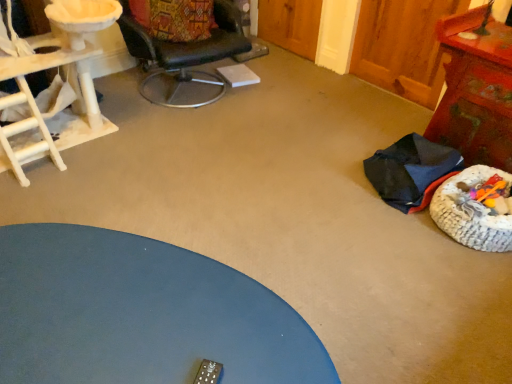
Question: Does blue matte table at lower left, which is the second table from right to left, appear on the left side of wooden textured table at right, acting as the 2th table starting from the front?

Choices:
 (A) no
 (B) yes

Answer: (B)

Question: Is blue matte table at lower left, marked as the first table in a left-to-right arrangement, oriented towards wooden textured table at right, which is the second table from left to right?

Choices:
 (A) no
 (B) yes

Answer: (B)

Question: Is blue matte table at lower left, marked as the first table in a left-to-right arrangement, bigger than wooden textured table at right, which is the second table from left to right?

Choices:
 (A) no
 (B) yes

Answer: (B)

Question: Does blue matte table at lower left, arranged as the 1th table when ordered from the bottom, lie in front of wooden textured table at right, which is counted as the 2th table, starting from the bottom?

Choices:
 (A) yes
 (B) no

Answer: (A)

Question: Is blue matte table at lower left, marked as the first table in a left-to-right arrangement, not near wooden textured table at right, which appears as the first table when viewed from the top?

Choices:
 (A) no
 (B) yes

Answer: (B)

Question: From a real-world perspective, is blue matte table at lower left, the 2th table viewed from the back, beneath wooden textured table at right, which is the second table from left to right?

Choices:
 (A) yes
 (B) no

Answer: (A)

Question: From a real-world perspective, does dark blue fabric chair at lower right, the first chair when ordered from bottom to top, stand above black leather chair at upper center, which ranks as the 1th chair in top-to-bottom order?

Choices:
 (A) no
 (B) yes

Answer: (A)

Question: Is the depth of dark blue fabric chair at lower right, marked as the first chair in a right-to-left arrangement, less than that of black leather chair at upper center, the second chair when ordered from bottom to top?

Choices:
 (A) no
 (B) yes

Answer: (B)

Question: Considering the relative sizes of dark blue fabric chair at lower right, marked as the first chair in a right-to-left arrangement, and black leather chair at upper center, the 1th chair from the left, in the image provided, is dark blue fabric chair at lower right, marked as the first chair in a right-to-left arrangement, smaller than black leather chair at upper center, the 1th chair from the left,?

Choices:
 (A) yes
 (B) no

Answer: (A)

Question: Can you confirm if dark blue fabric chair at lower right, which is the second chair in left-to-right order, is thinner than black leather chair at upper center, placed as the 2th chair when sorted from right to left?

Choices:
 (A) no
 (B) yes

Answer: (B)

Question: Is dark blue fabric chair at lower right, the first chair when ordered from bottom to top, not within black leather chair at upper center, which ranks as the 1th chair in top-to-bottom order?

Choices:
 (A) no
 (B) yes

Answer: (B)

Question: Is dark blue fabric chair at lower right, the first chair when ordered from bottom to top, shorter than black leather chair at upper center, the second chair when ordered from bottom to top?

Choices:
 (A) no
 (B) yes

Answer: (B)

Question: From a real-world perspective, is dark blue fabric chair at lower right, the first chair when ordered from bottom to top, below blue matte table at lower left, the 2th table viewed from the back?

Choices:
 (A) no
 (B) yes

Answer: (B)